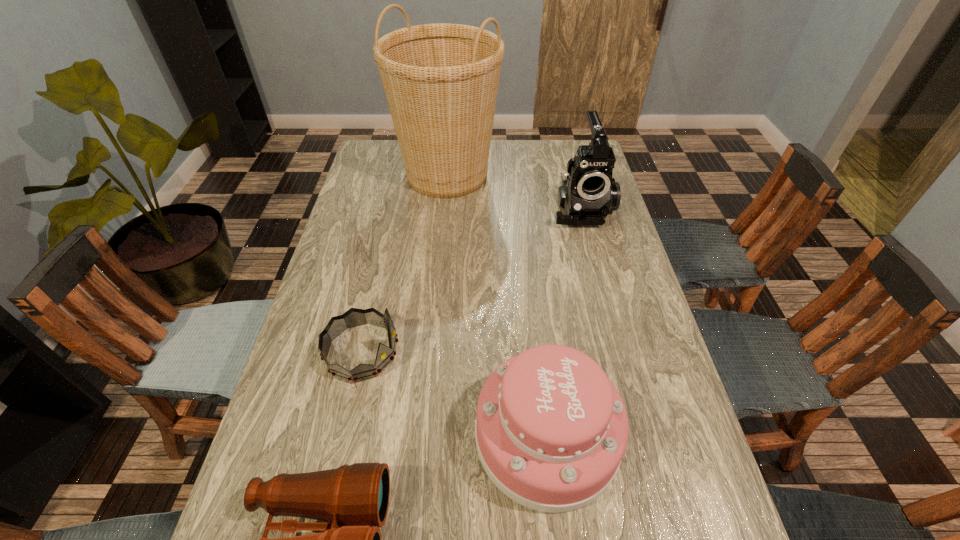
This screenshot has width=960, height=540. In order to click on the tallest object in this screenshot , I will do `click(441, 81)`.

Identify the location of camcorder. This screenshot has width=960, height=540. (588, 192).

Identify the location of the third shortest object. (551, 429).

You are a GUI agent. You are given a task and a screenshot of the screen. Output one action in this format:
    pyautogui.click(x=<x>, y=<y>)
    Task: Click on the tiara
    Image resolution: width=960 pixels, height=540 pixels.
    Given the screenshot: What is the action you would take?
    pyautogui.click(x=353, y=317)

This screenshot has height=540, width=960. Identify the location of free location located 0.070m on the back of the tallest object. (450, 139).

The image size is (960, 540). I want to click on free space located on the lens mount of the camcorder, so click(x=600, y=280).

You are a GUI agent. You are given a task and a screenshot of the screen. Output one action in this format:
    pyautogui.click(x=<x>, y=<y>)
    Task: Click on the vacant space situated 0.280m on the back of the third tallest object
    
    Given the screenshot: What is the action you would take?
    (x=531, y=288)

Identify the location of vacant area located at the front of the tiara with jewels. The image size is (960, 540). (547, 351).

Locate an element on the screen. The width and height of the screenshot is (960, 540). object positioned at the far edge is located at coordinates (441, 81).

At what (x,y) coordinates should I click in order to perform the action: click on basket positioned at the left edge. Please return your answer as a coordinate pair (x, y). This screenshot has height=540, width=960. Looking at the image, I should click on (441, 81).